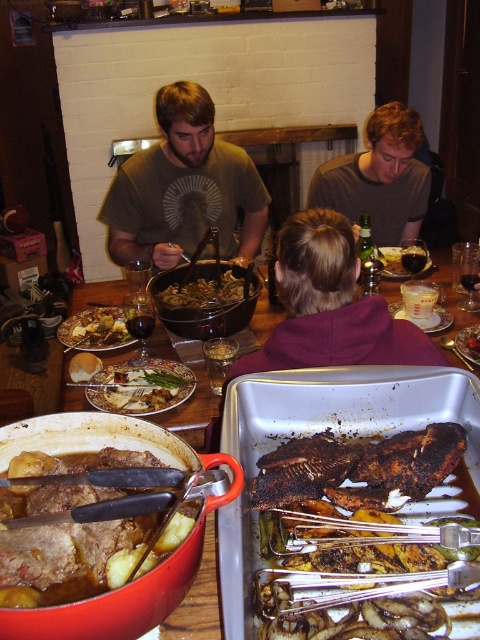
You are setting up a buffet table and have the matte black tray at center and the translucent plastic measuring cup at center. Which item can you place more food on top of without it falling off?

The matte black tray at center is bigger than the translucent plastic measuring cup at center, so you can place more food on top of the matte black tray at center without it falling off.

You are at the dining table and want to place a small bowl on the matte black tray at center. There is a point marked at coordinates (193, 544). Is this point on the matte black tray at center?

Yes, the point at coordinates (193, 544) is on the matte black tray at center, so placing the small bowl there would be appropriate.

You are a chef standing at the dining table. You need to reach the matte black tray at center from where you are currently standing near the matte gray shirt at upper center. Is the distance between them sufficient for you to comfortably stretch and grab it without moving your feet? Assume an average arm reach of 1.5 meters.

The distance between the matte gray shirt at upper center and the matte black tray at center is 1.56 meters. Since the average arm reach is 1.5 meters, the chef would need to take a small step forward to comfortably reach the matte black tray at center.